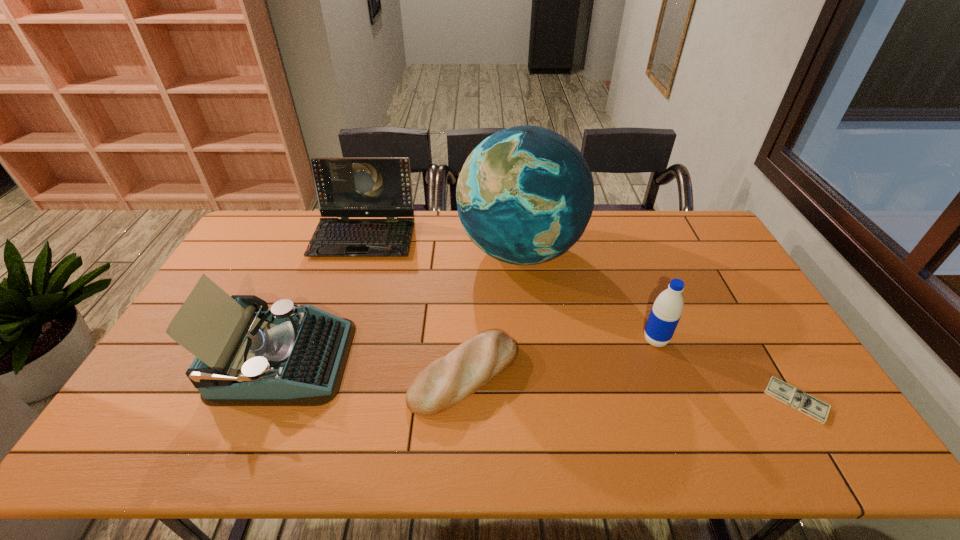
Image resolution: width=960 pixels, height=540 pixels. What are the coordinates of `vacant space at the near edge` in the screenshot? It's located at (517, 444).

You are a GUI agent. You are given a task and a screenshot of the screen. Output one action in this format:
    pyautogui.click(x=<x>, y=<y>)
    Task: Click on the free space at the right edge of the desktop
    
    Given the screenshot: What is the action you would take?
    pyautogui.click(x=701, y=266)

Identify the location of vacant area at the near left corner. (174, 454).

The width and height of the screenshot is (960, 540). Find the location of `free space between the second object from right to left and the bread`. free space between the second object from right to left and the bread is located at coordinates (560, 357).

You are a GUI agent. You are given a task and a screenshot of the screen. Output one action in this format:
    pyautogui.click(x=<x>, y=<y>)
    Task: Click on the vacant area that lies between the laptop computer and the rightmost object
    Image resolution: width=960 pixels, height=540 pixels.
    Given the screenshot: What is the action you would take?
    pyautogui.click(x=580, y=318)

Where is `empty space between the globe and the water bottle`? empty space between the globe and the water bottle is located at coordinates (588, 295).

Where is `free space between the rightmost object and the second object from right to left`? free space between the rightmost object and the second object from right to left is located at coordinates (726, 370).

The image size is (960, 540). Identify the location of vacant point located between the fifth tallest object and the second object from right to left. (560, 357).

Where is `vacant space that is in between the typewriter and the tallest object`? This screenshot has height=540, width=960. vacant space that is in between the typewriter and the tallest object is located at coordinates (401, 305).

Find the location of a particular element. This screenshot has height=540, width=960. free point between the tallest object and the fifth object from left to right is located at coordinates (588, 295).